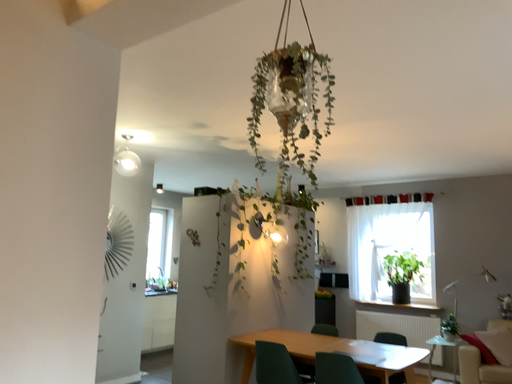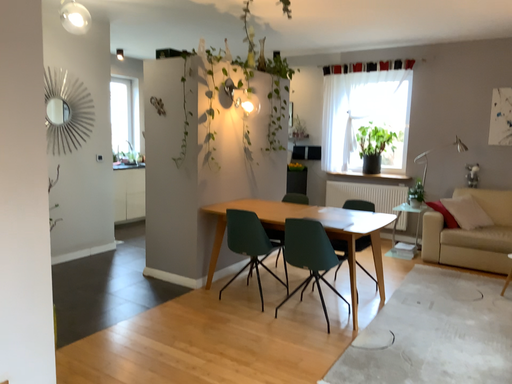
Question: How did the camera likely rotate when shooting the video?

Choices:
 (A) rotated downward
 (B) rotated upward

Answer: (A)